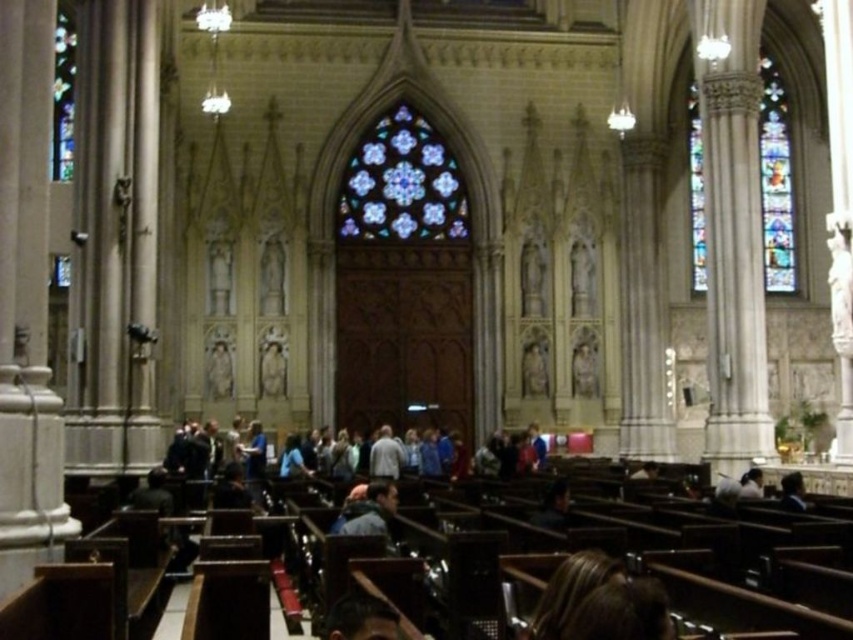
Looking at this image, does stained glass window at right have a greater width compared to light brown leather jacket at lower right?

Correct, the width of stained glass window at right exceeds that of light brown leather jacket at lower right.

Looking at this image, between stained glass window at right and light brown leather jacket at lower right, which one is positioned higher?

stained glass window at right

The height and width of the screenshot is (640, 853). Identify the location of stained glass window at right. (775, 182).

Does point (379, 456) lie in front of point (755, 490)?

No, it is not.

Does light gray fabric jacket at center have a greater width compared to light brown leather jacket at lower right?

In fact, light gray fabric jacket at center might be narrower than light brown leather jacket at lower right.

Which is behind, point (387, 474) or point (751, 490)?

The point (387, 474) is more distant.

Where is `light gray fabric jacket at center`? This screenshot has height=640, width=853. light gray fabric jacket at center is located at coordinates (386, 454).

Between stained glass at center and light gray fabric jacket at center, which one is positioned lower?

light gray fabric jacket at center is below.

Is stained glass at center wider than light gray fabric jacket at center?

Yes, stained glass at center is wider than light gray fabric jacket at center.

Is point (373, 160) less distant than point (369, 467)?

No, it is behind (369, 467).

The height and width of the screenshot is (640, 853). Identify the location of stained glass at center. (402, 182).